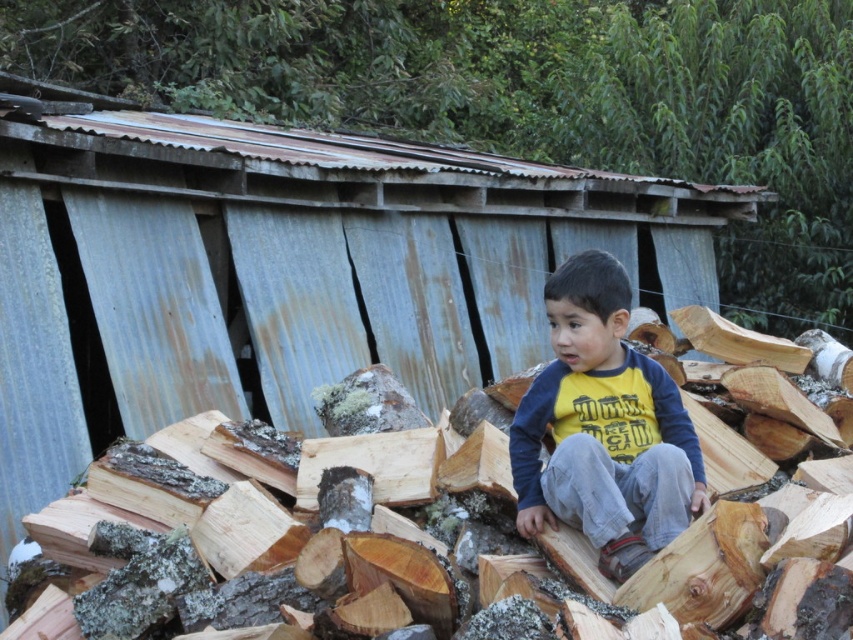
Looking at this image, how distant is brown rough wood at center from yellow cotton shirt at center?

brown rough wood at center and yellow cotton shirt at center are 1.09 meters apart.

Is brown rough wood at center bigger than yellow cotton shirt at center?

Yes, brown rough wood at center is bigger than yellow cotton shirt at center.

Where is `brown rough wood at center`? This screenshot has height=640, width=853. brown rough wood at center is located at coordinates (573, 506).

Find the location of a particular element. brown rough wood at center is located at coordinates (573, 506).